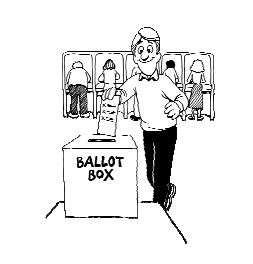
Find the location of `white booths outlined in black`. white booths outlined in black is located at coordinates (191, 52), (171, 55), (129, 57), (109, 57), (69, 57).